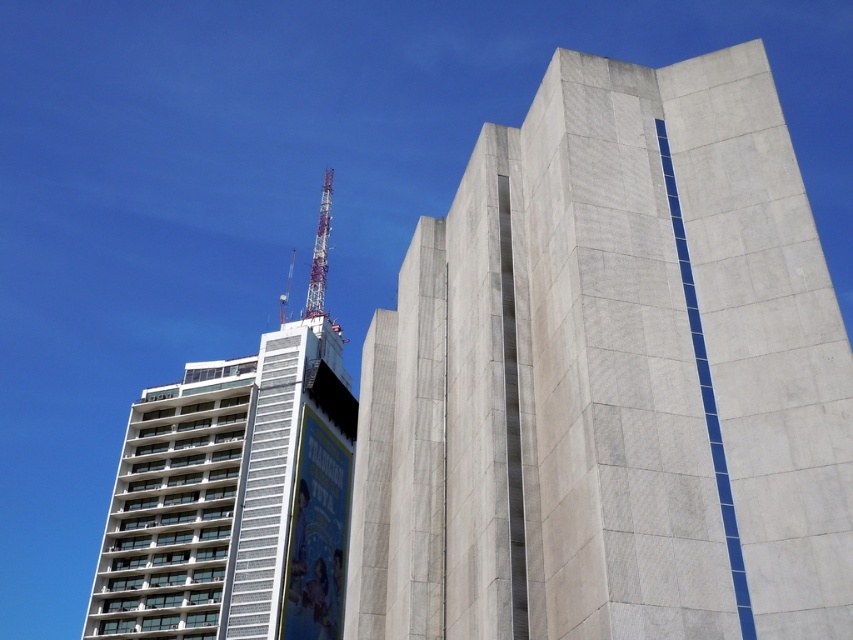
How distant is metallic tower at upper center from metallic silver crane at upper center?

metallic tower at upper center and metallic silver crane at upper center are 25.84 meters apart from each other.

Is metallic tower at upper center above metallic silver crane at upper center?

Yes.

This screenshot has height=640, width=853. What are the coordinates of `metallic tower at upper center` in the screenshot? It's located at (318, 253).

At what (x,y) coordinates should I click in order to perform the action: click on metallic tower at upper center. Please return your answer as a coordinate pair (x, y). This screenshot has height=640, width=853. Looking at the image, I should click on coord(318,253).

Does concrete block building at center have a smaller size compared to metallic tower at upper center?

Correct, concrete block building at center occupies less space than metallic tower at upper center.

Is point (643, 513) positioned in front of point (321, 209)?

That is True.

Does point (439, 396) come farther from viewer compared to point (329, 200)?

No, (439, 396) is closer to viewer.

Locate an element on the screen. concrete block building at center is located at coordinates (612, 380).

Does white concrete building at upper left have a lesser height compared to metallic tower at upper center?

Indeed, white concrete building at upper left has a lesser height compared to metallic tower at upper center.

Is point (180, 480) less distant than point (323, 266)?

Yes, it is in front of point (323, 266).

Identify the location of white concrete building at upper left. The image size is (853, 640). (219, 490).